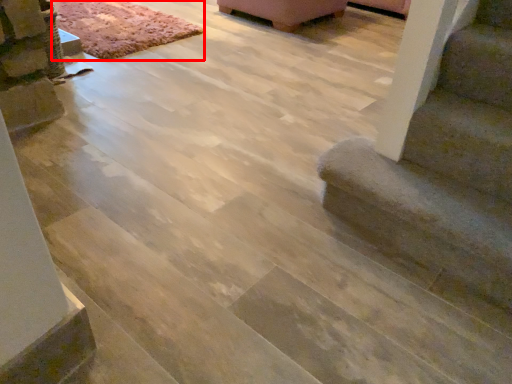
Question: From the image's perspective, where is mat (annotated by the red box) located in relation to stairs in the image?

Choices:
 (A) below
 (B) above

Answer: (B)